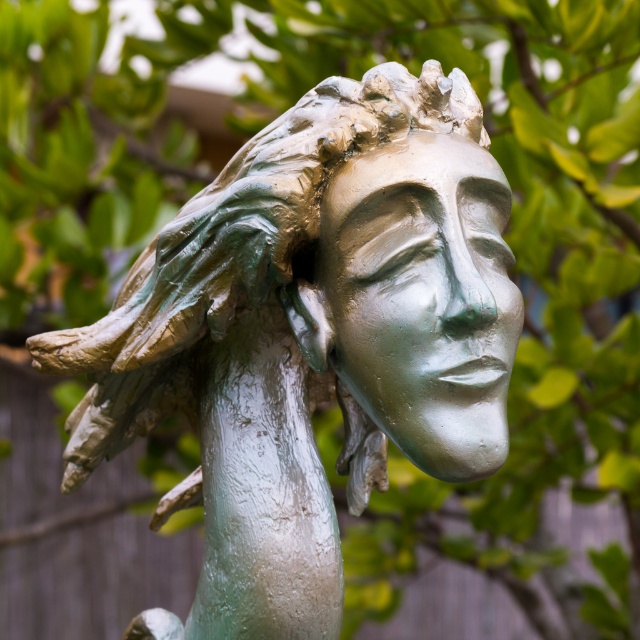
Question: Which point is farther to the camera?

Choices:
 (A) (323, 129)
 (B) (497, 397)

Answer: (A)

Question: Is the position of green patina statue at center less distant than that of green patina face at center?

Choices:
 (A) yes
 (B) no

Answer: (A)

Question: Can you confirm if green patina statue at center is thinner than green patina face at center?

Choices:
 (A) yes
 (B) no

Answer: (B)

Question: Which of the following is the farthest from the observer?

Choices:
 (A) green patina face at center
 (B) green patina statue at center

Answer: (A)

Question: Observing the image, what is the correct spatial positioning of green patina statue at center in reference to green patina face at center?

Choices:
 (A) left
 (B) right

Answer: (A)